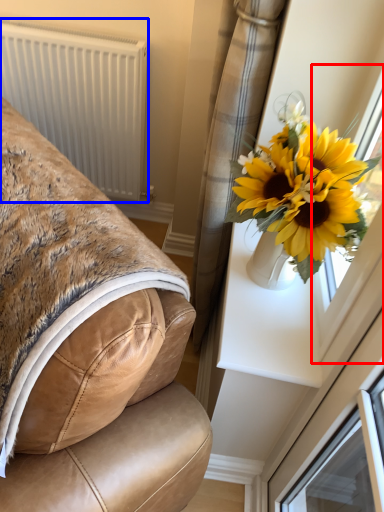
Question: Among these objects, which one is farthest to the camera, window frame (highlighted by a red box) or radiator (highlighted by a blue box)?

Choices:
 (A) window frame
 (B) radiator

Answer: (B)